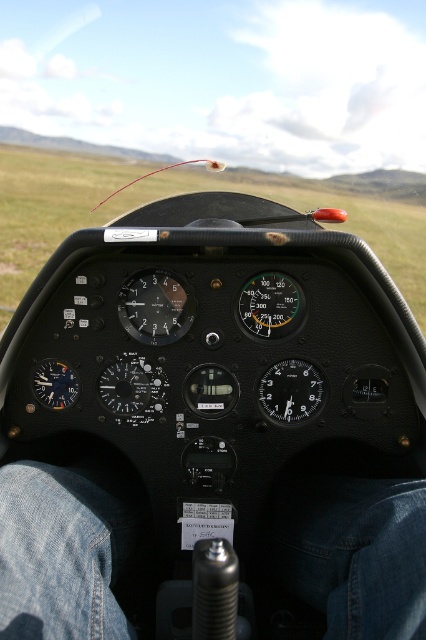
You are a pilot preparing to take off and notice the jeans at lower center and green grass at center in your cockpit view. Which object is closer to you from your seated position?

The jeans at lower center is closer to you because it is in front of the green grass at center in the cockpit view.

You are a passenger in the glider and want to check your phone for directions. The jeans at lower center and green grass at center are in your line of sight. Which object is closer to you?

The jeans at lower center is located below green grass at center, so it is closer to you.